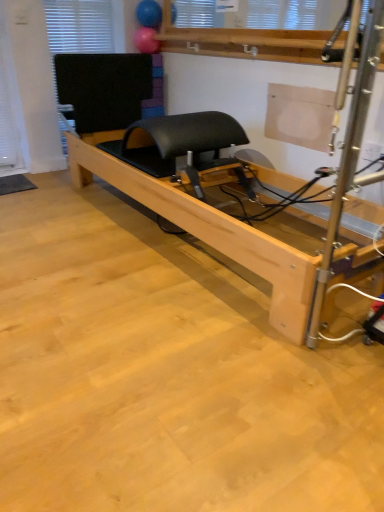
Question: In terms of size, does rubber ball at upper center, positioned as the first balloon in bottom-to-top order, appear bigger or smaller than natural wood pilates reformer at center?

Choices:
 (A) small
 (B) big

Answer: (A)

Question: From the image's perspective, is rubber ball at upper center, positioned as the first balloon in bottom-to-top order, located above or below natural wood pilates reformer at center?

Choices:
 (A) below
 (B) above

Answer: (B)

Question: Based on their relative distances, which object is farther from the black rubber yoga mat at lower left?

Choices:
 (A) natural wood pilates reformer at center
 (B) rubber ball at upper center, positioned as the first balloon in bottom-to-top order
 (C) rubberized blue ball at upper center, positioned as the second balloon in bottom-to-top order
 (D) black matte window at upper left

Answer: (C)

Question: Estimate the real-world distances between objects in this image. Which object is farther from the rubberized blue ball at upper center, positioned as the second balloon in bottom-to-top order?

Choices:
 (A) black rubber yoga mat at lower left
 (B) natural wood pilates reformer at center
 (C) black matte window at upper left
 (D) rubber ball at upper center, which is the 2th balloon from top to bottom

Answer: (A)